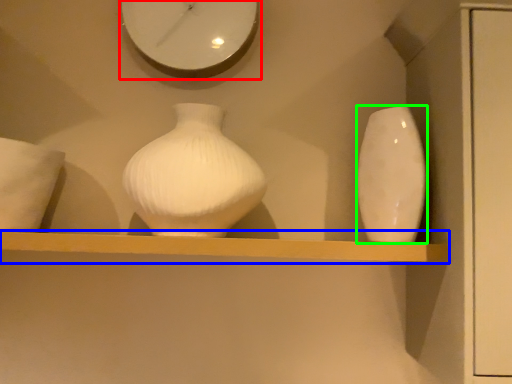
Question: Considering the real-world distances, which object is closest to clock (highlighted by a red box)? shelf (highlighted by a blue box) or vase (highlighted by a green box).

Choices:
 (A) shelf
 (B) vase

Answer: (B)